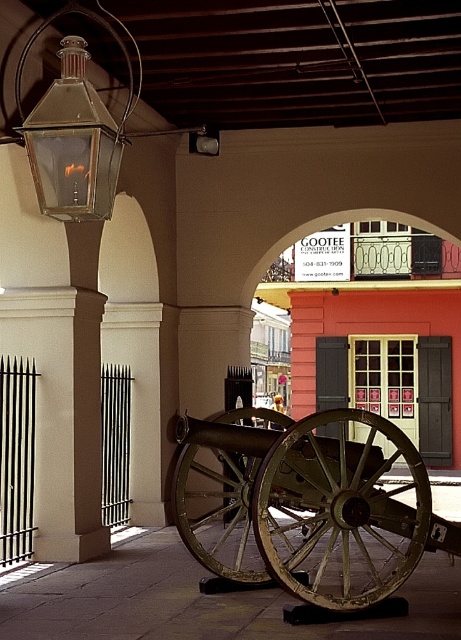
In the scene shown: You are an architect inspecting the courtyard. You need to determine if a new decorative flagpole, which is 2 meters tall, can be placed between the rusty metal cannon at center and the matte glass lantern at upper left without exceeding the height of the tallest object. Which object should you compare the flagpole height to, and why?

You should compare the flagpole height to the rusty metal cannon at center because it is taller than the matte glass lantern at upper left according to the description.

Based on the photo, you are an explorer navigating through this historical courtyard. You notice the rusty metal cannon at center and the matte glass lantern at upper left. Which object is closer to you as you face the scene?

The rusty metal cannon at center is closer to you because the matte glass lantern at upper left is positioned behind it, meaning the cannon is in front.

You are an interior designer planning to place a new decorative item in the courtyard. You have two options from the scene, the matte glass lantern at upper left and the metallic glass lantern at upper center. Which one is bigger and would be more suitable for a focal point?

The matte glass lantern at upper left is larger in size compared to the metallic glass lantern at upper center, making it more suitable as a focal point.